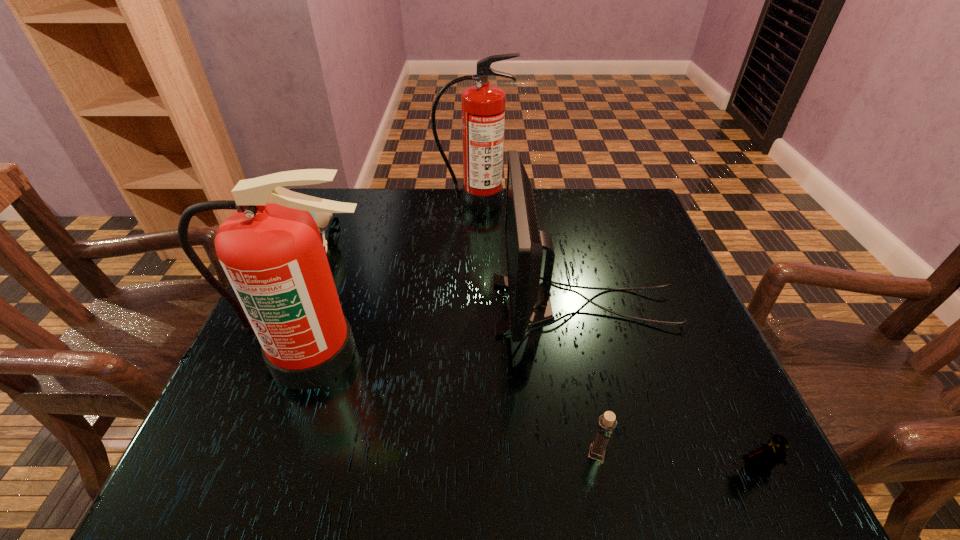
I want to click on vacant space located on the screen side of the computer monitor, so click(470, 305).

Locate an element on the screen. The image size is (960, 540). vacant space located 0.290m on the screen side of the computer monitor is located at coordinates (358, 305).

Where is `vacant region located 0.130m at the face of the third shortest object`? Image resolution: width=960 pixels, height=540 pixels. vacant region located 0.130m at the face of the third shortest object is located at coordinates [292, 314].

In order to click on free space located 0.360m on the left of the candle holder in this screenshot , I will do `click(359, 454)`.

Identify the location of fire extinguisher located in the far edge section of the desktop. This screenshot has height=540, width=960. (482, 106).

The image size is (960, 540). Find the location of `bird situated at the far edge`. bird situated at the far edge is located at coordinates (322, 219).

The image size is (960, 540). I want to click on candle holder at the near edge, so (x=607, y=422).

I want to click on Lego present at the near edge, so click(x=762, y=461).

Where is `fire extinguisher present at the left edge`? This screenshot has height=540, width=960. fire extinguisher present at the left edge is located at coordinates (271, 250).

Where is `bird that is at the left edge`? The image size is (960, 540). bird that is at the left edge is located at coordinates (322, 219).